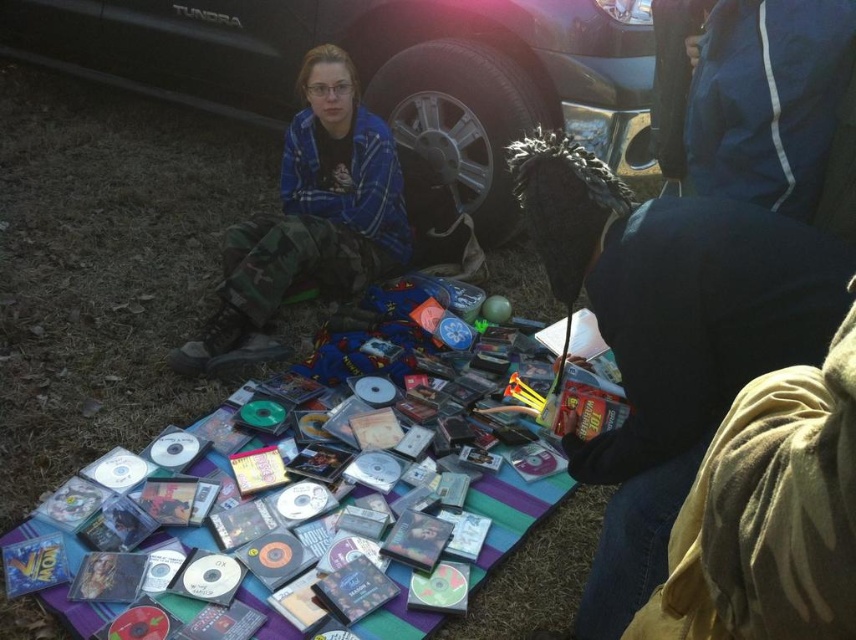
Which is in front, point (587, 208) or point (244, 232)?

Point (587, 208) is more forward.

Describe the element at coordinates (667, 337) in the screenshot. This screenshot has width=856, height=640. I see `dark blue fabric at lower right` at that location.

The image size is (856, 640). Identify the location of dark blue fabric at lower right. (667, 337).

Does point (384, 170) come farther from viewer compared to point (777, 100)?

Yes.

Does blue plaid shirt at center have a greater width compared to blue fabric jacket at upper right?

Indeed, blue plaid shirt at center has a greater width compared to blue fabric jacket at upper right.

Does point (358, 113) come behind point (794, 170)?

Yes, point (358, 113) is behind point (794, 170).

The height and width of the screenshot is (640, 856). Identify the location of blue plaid shirt at center. (310, 220).

Does point (381, 132) come behind point (16, 428)?

Yes, point (381, 132) is behind point (16, 428).

Can you confirm if blue plaid shirt at center is thinner than clear plastic cds at center?

Yes.

Between point (354, 195) and point (520, 285), which one is positioned behind?

Positioned behind is point (520, 285).

At what (x,y) coordinates should I click in order to perform the action: click on blue plaid shirt at center. Please return your answer as a coordinate pair (x, y). Looking at the image, I should click on (310, 220).